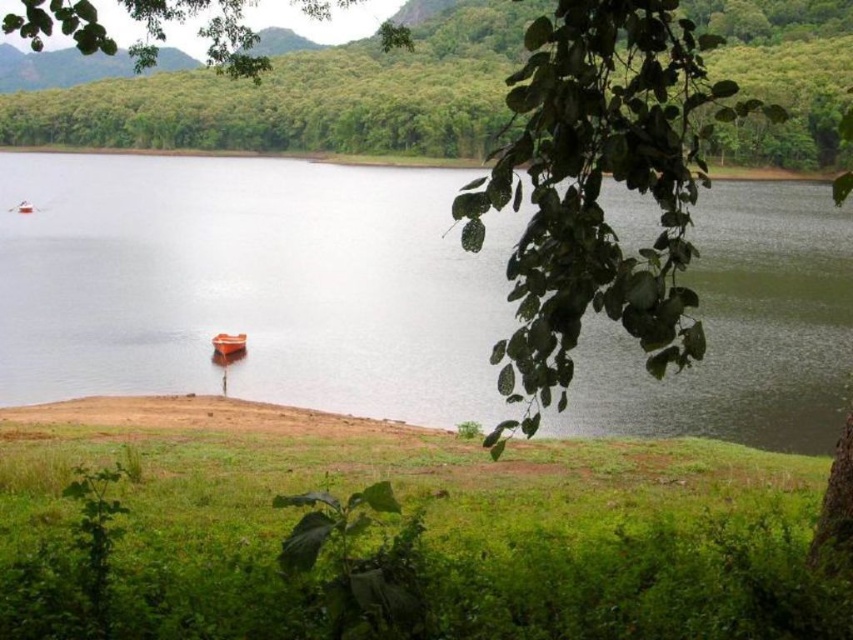
Between point (643, 241) and point (32, 209), which one is positioned behind?

Point (32, 209)

Does clear water at center have a smaller size compared to orange matte boat at center?

Actually, clear water at center might be larger than orange matte boat at center.

This screenshot has width=853, height=640. Describe the element at coordinates (248, 284) in the screenshot. I see `clear water at center` at that location.

Identify the location of clear water at center. This screenshot has height=640, width=853. (248, 284).

Who is more forward, (393, 136) or (22, 198)?

Point (22, 198) is more forward.

Who is more distant from viewer, (790, 164) or (22, 205)?

The point (790, 164) is behind.

Is point (450, 132) less distant than point (20, 204)?

No.

At what (x,y) coordinates should I click in order to perform the action: click on green leafy tree at upper center. Please return your answer as a coordinate pair (x, y). Image resolution: width=853 pixels, height=640 pixels. Looking at the image, I should click on (300, 99).

Is clear water at center smaller than green leafy tree at upper center?

Correct, clear water at center occupies less space than green leafy tree at upper center.

Is clear water at center bigger than green leafy tree at upper center?

Actually, clear water at center might be smaller than green leafy tree at upper center.

Is point (91, 228) positioned in front of point (374, 124)?

Yes, it is in front of point (374, 124).

At what (x,y) coordinates should I click in order to perform the action: click on clear water at center. Please return your answer as a coordinate pair (x, y). Looking at the image, I should click on (248, 284).